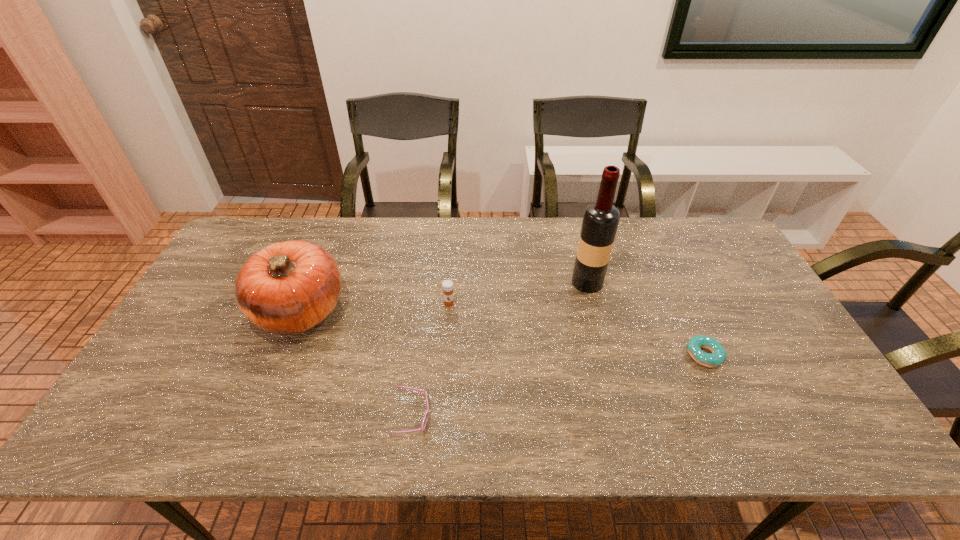
Identify the location of blank area located on the left of the tallest object. (x=445, y=282).

Find the location of a particular element. blank space located on the left of the leftmost object is located at coordinates (206, 310).

The image size is (960, 540). What are the coordinates of `blank space located 0.080m on the label side of the third object from left to right` in the screenshot? It's located at (447, 329).

Find the location of a particular element. This screenshot has height=540, width=960. vacant space positioned 0.350m on the front-facing side of the nearest object is located at coordinates (580, 417).

Find the location of `free location located on the front of the doughnut`. free location located on the front of the doughnut is located at coordinates (718, 387).

This screenshot has width=960, height=540. I want to click on object that is at the near edge, so click(x=427, y=412).

The height and width of the screenshot is (540, 960). I want to click on vacant region at the far edge, so click(495, 234).

Locate an element on the screen. The image size is (960, 540). free space at the near edge of the desktop is located at coordinates (590, 423).

Locate an element on the screen. This screenshot has height=540, width=960. free space at the right edge is located at coordinates (723, 313).

At what (x,y) coordinates should I click in order to perform the action: click on blank space at the far left corner of the desktop. Please return your answer as a coordinate pair (x, y). This screenshot has width=960, height=540. Looking at the image, I should click on (247, 224).